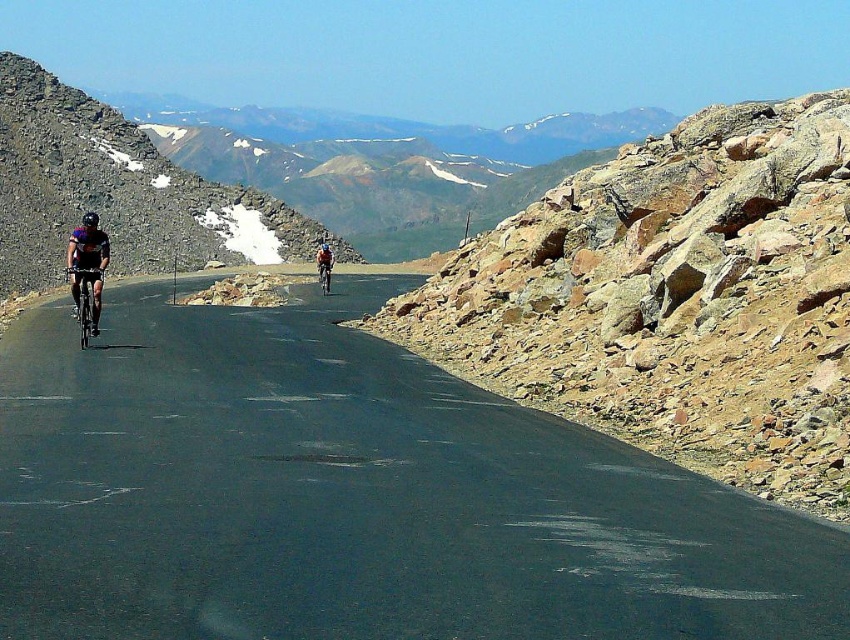
At what (x,y) coordinates should I click in order to perform the action: click on black asphalt road at center. Please return your answer as a coordinate pair (x, y). The width and height of the screenshot is (850, 640). Looking at the image, I should click on pos(354,496).

Who is lower down, rocky gray mountain at left or shiny black bicycle at left?

shiny black bicycle at left is below.

Can you confirm if rocky gray mountain at left is smaller than shiny black bicycle at left?

Actually, rocky gray mountain at left might be larger than shiny black bicycle at left.

Describe the element at coordinates (112, 189) in the screenshot. Image resolution: width=850 pixels, height=640 pixels. I see `rocky gray mountain at left` at that location.

The image size is (850, 640). In order to click on rocky gray mountain at left in this screenshot , I will do `click(112, 189)`.

Does rocky gray mountain at left lie behind shiny metallic bicycle at center?

That is True.

Between rocky gray mountain at left and shiny metallic bicycle at center, which one has more height?

rocky gray mountain at left is taller.

Is point (293, 227) closer to camera compared to point (323, 262)?

No, (293, 227) is behind (323, 262).

Locate an element on the screen. Image resolution: width=850 pixels, height=640 pixels. rocky gray mountain at left is located at coordinates (112, 189).